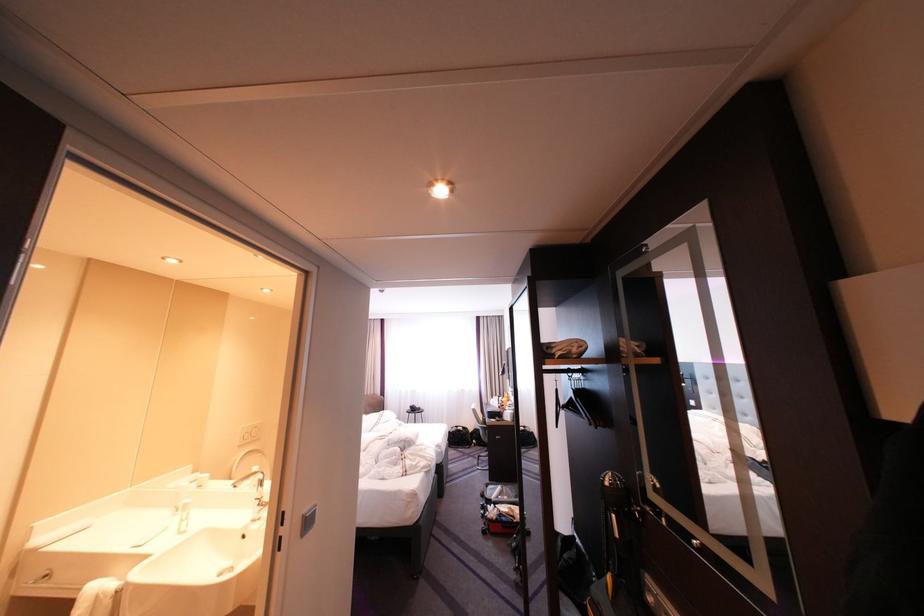
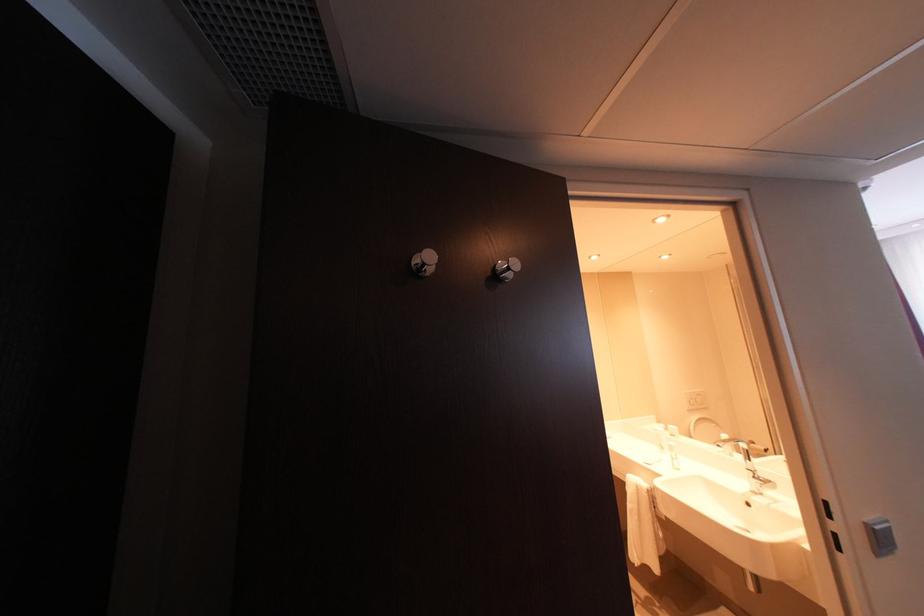
Question: The camera is either moving clockwise (left) or counter-clockwise (right) around the object. The first image is from the beginning of the video and the second image is from the end. Is the camera moving left or right when shooting the video?

Choices:
 (A) Left
 (B) Right

Answer: (B)